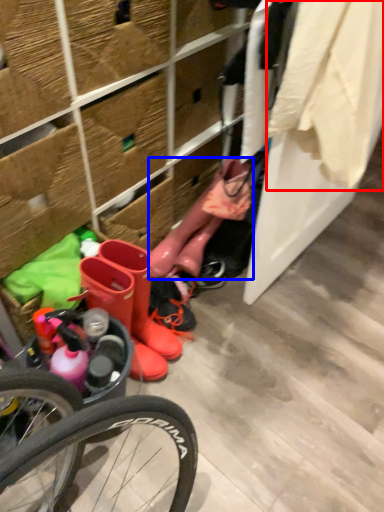
Question: Which object is closer to the camera taking this photo, clothing (highlighted by a red box) or boot (highlighted by a blue box)?

Choices:
 (A) clothing
 (B) boot

Answer: (A)